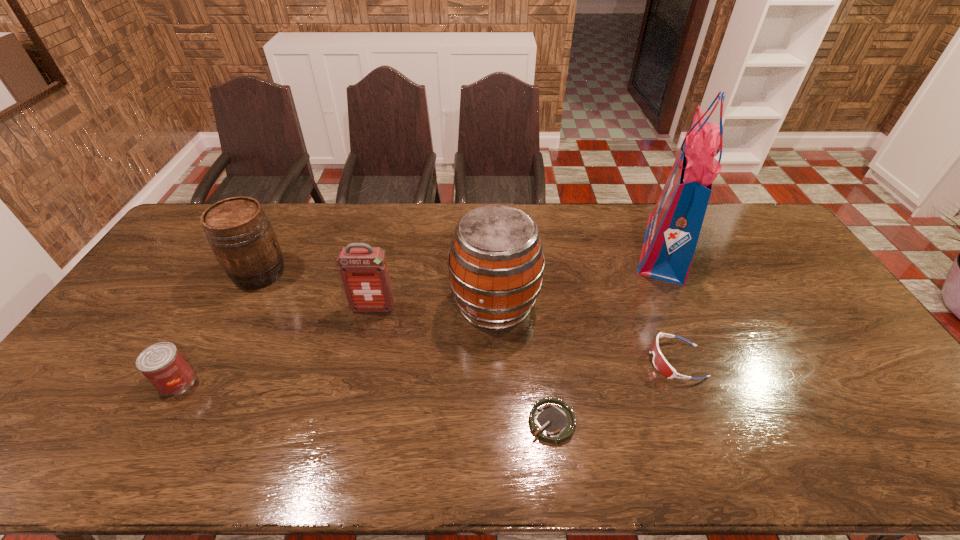
Identify the location of object positioned at the far edge. This screenshot has width=960, height=540. (674, 225).

Identify the location of object at the near edge. (551, 420).

Locate an element on the screen. The height and width of the screenshot is (540, 960). blank space at the far edge is located at coordinates (298, 233).

Identify the location of free space at the near edge of the desktop. The width and height of the screenshot is (960, 540). (791, 454).

The width and height of the screenshot is (960, 540). What are the coordinates of `free space at the left edge of the desktop` in the screenshot? It's located at (99, 402).

This screenshot has width=960, height=540. What are the coordinates of `vacant space at the far left corner` in the screenshot? It's located at (196, 215).

Find the location of `vacant space that's between the shorter cider and the first-aid kit`. vacant space that's between the shorter cider and the first-aid kit is located at coordinates (317, 291).

Where is `free spot between the shortest object and the shorter cider`? free spot between the shortest object and the shorter cider is located at coordinates (406, 348).

The height and width of the screenshot is (540, 960). I want to click on free space between the right cider and the sixth tallest object, so click(586, 333).

The image size is (960, 540). Find the location of `vacant space that's between the can and the right cider`. vacant space that's between the can and the right cider is located at coordinates (336, 343).